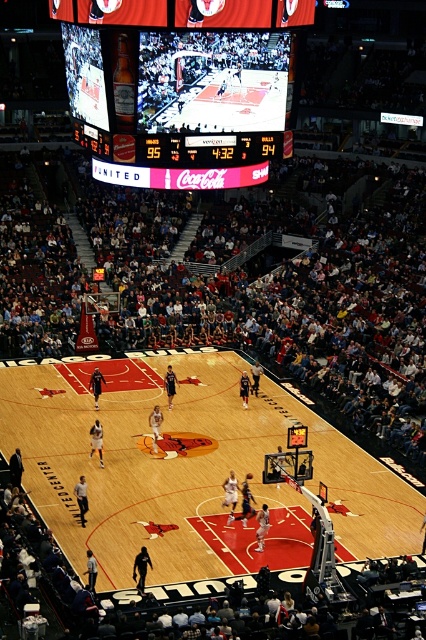
Question: Is matte digital scoreboard at upper center to the right of shiny orange basketball at center from the viewer's perspective?

Choices:
 (A) yes
 (B) no

Answer: (B)

Question: Estimate the real-world distances between objects in this image. Which object is closer to the shiny orange basketball at center?

Choices:
 (A) matte digital scoreboard at upper center
 (B) wooden polished basketball court at center

Answer: (B)

Question: Estimate the real-world distances between objects in this image. Which object is closer to the wooden polished basketball court at center?

Choices:
 (A) shiny orange basketball at center
 (B) matte digital scoreboard at upper center

Answer: (A)

Question: Does matte digital scoreboard at upper center appear on the left side of shiny orange basketball at center?

Choices:
 (A) yes
 (B) no

Answer: (A)

Question: Can you confirm if wooden polished basketball court at center is positioned below matte digital scoreboard at upper center?

Choices:
 (A) no
 (B) yes

Answer: (B)

Question: Based on their relative distances, which object is nearer to the wooden polished basketball court at center?

Choices:
 (A) shiny orange basketball at center
 (B) matte digital scoreboard at upper center

Answer: (A)